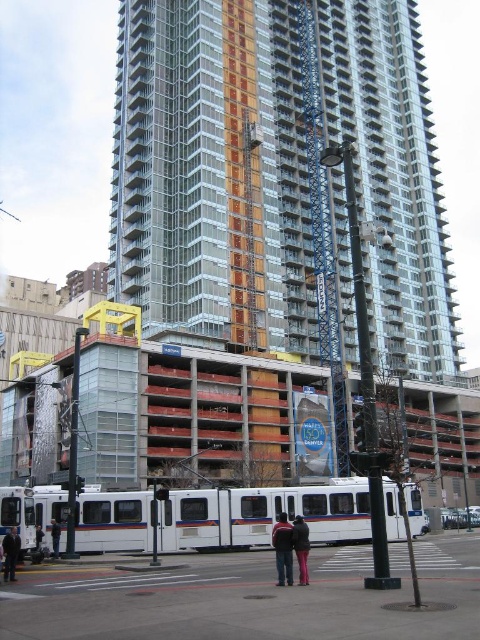
Between point (12, 534) and point (56, 547), which one is positioned in front?

Point (12, 534)

In the scene shown: Does dark gray jacket at lower left appear on the right side of white fabric jacket at lower left?

Yes, dark gray jacket at lower left is to the right of white fabric jacket at lower left.

Measure the distance between dark gray jacket at lower left and camera.

The distance of dark gray jacket at lower left from camera is 33.43 meters.

At what (x,y) coordinates should I click in order to perform the action: click on dark gray jacket at lower left. Please return your answer as a coordinate pair (x, y). Looking at the image, I should click on (11, 554).

Is clear glass building at center further to camera compared to dark gray jacket at lower left?

Yes, clear glass building at center is behind dark gray jacket at lower left.

Which is more to the left, clear glass building at center or dark gray jacket at lower left?

dark gray jacket at lower left is more to the left.

This screenshot has height=640, width=480. I want to click on clear glass building at center, so click(x=212, y=170).

Can you confirm if clear glass building at center is positioned above matte black jacket at center?

Yes.

This screenshot has width=480, height=640. Describe the element at coordinates (212, 170) in the screenshot. I see `clear glass building at center` at that location.

Does point (265, 97) come farther from viewer compared to point (304, 570)?

Yes.

Image resolution: width=480 pixels, height=640 pixels. Identify the location of clear glass building at center. (212, 170).